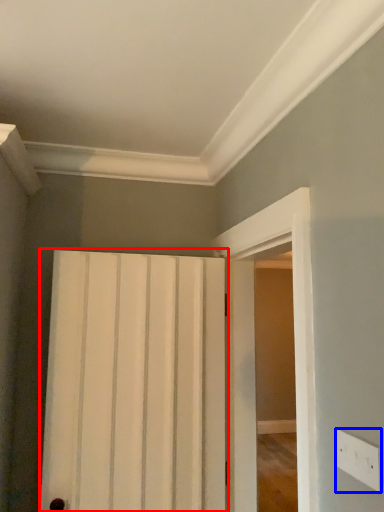
Question: Among these objects, which one is farthest to the camera, door (highlighted by a red box) or electric outlet (highlighted by a blue box)?

Choices:
 (A) door
 (B) electric outlet

Answer: (A)